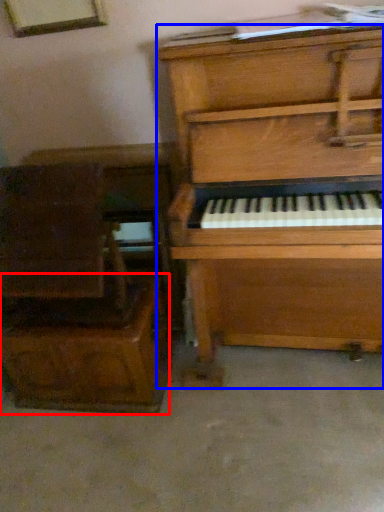
Question: Which object appears farthest to the camera in this image, drawer (highlighted by a red box) or piano (highlighted by a blue box)?

Choices:
 (A) drawer
 (B) piano

Answer: (A)